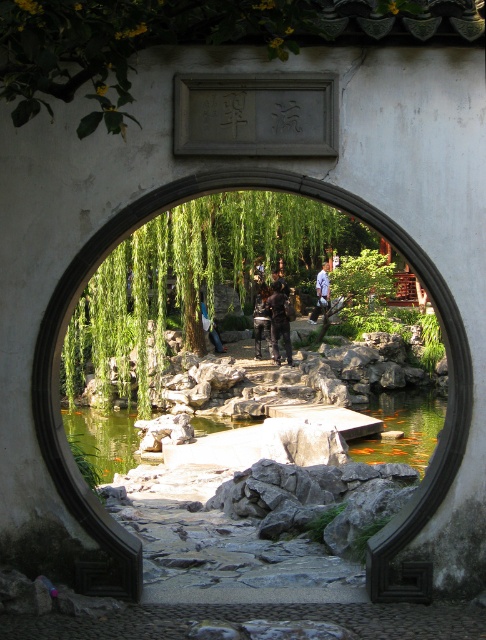
Question: Estimate the real-world distances between objects in this image. Which object is closer to the dark blue uniform at center?

Choices:
 (A) dark brown leather jacket at center
 (B) denim jacket at center

Answer: (A)

Question: Which of these objects is positioned closest to the dark blue uniform at center?

Choices:
 (A) dark brown leather jacket at center
 (B) green stone pond at center
 (C) dark blue jeans at center
 (D) denim jacket at center

Answer: (C)

Question: Is the position of stone at center more distant than that of green stone pond at center?

Choices:
 (A) yes
 (B) no

Answer: (B)

Question: Among these points, which one is nearest to the camera?

Choices:
 (A) (282, 336)
 (B) (204, 330)
 (C) (278, 280)

Answer: (A)

Question: Does denim jacket at center appear under dark blue uniform at center?

Choices:
 (A) yes
 (B) no

Answer: (A)

Question: Is dark brown leather jacket at center in front of dark blue jeans at center?

Choices:
 (A) yes
 (B) no

Answer: (A)